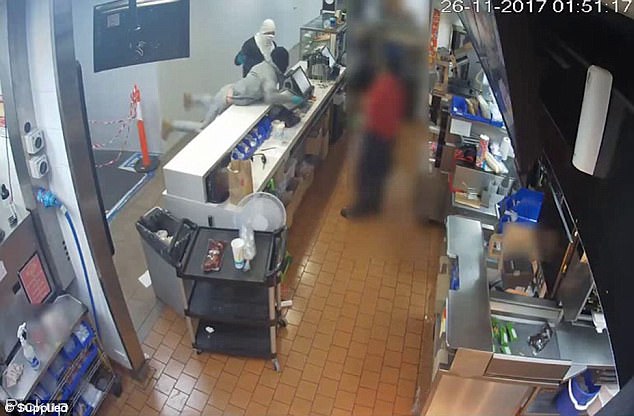
I want to click on tv, so click(163, 28).